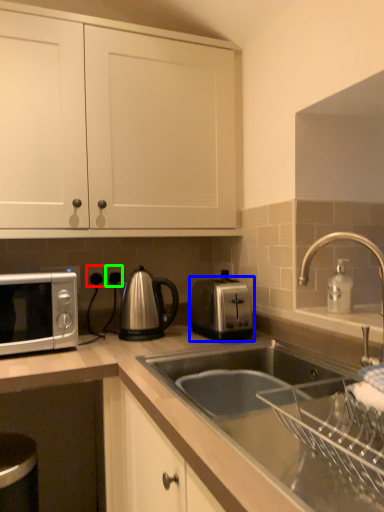
Question: Which is nearer to the electric outlet (highlighted by a red box)? toaster (highlighted by a blue box) or electric outlet (highlighted by a green box).

Choices:
 (A) toaster
 (B) electric outlet

Answer: (B)